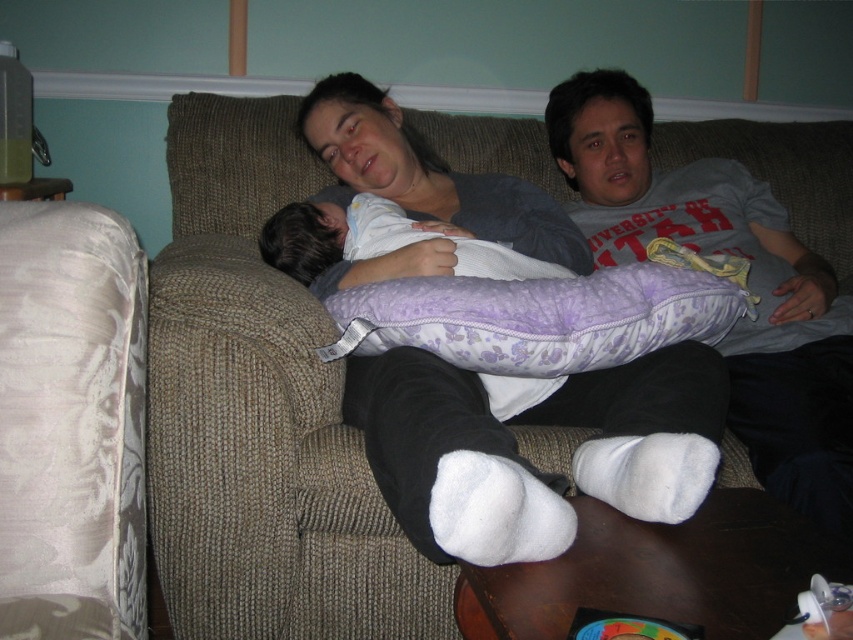
Question: Is brown textured couch at center bigger than gray cotton t-shirt at upper right?

Choices:
 (A) yes
 (B) no

Answer: (A)

Question: Which point is farther to the camera?

Choices:
 (A) gray cotton t-shirt at upper right
 (B) brown textured couch at center

Answer: (B)

Question: Does brown textured couch at center have a greater width compared to gray cotton t-shirt at upper right?

Choices:
 (A) yes
 (B) no

Answer: (A)

Question: Can you confirm if brown textured couch at center is smaller than gray cotton t-shirt at upper right?

Choices:
 (A) no
 (B) yes

Answer: (A)